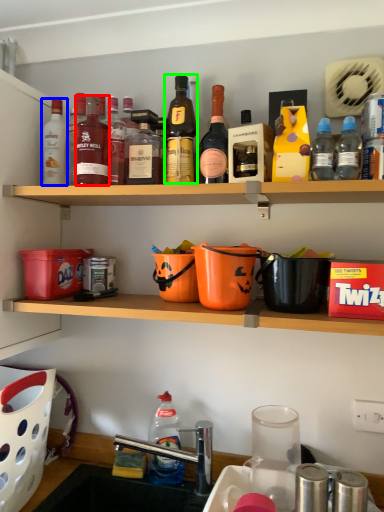
Question: Based on their relative distances, which object is nearer to bottle (highlighted by a red box)? Choose from bottle (highlighted by a blue box) and bottle (highlighted by a green box).

Choices:
 (A) bottle
 (B) bottle

Answer: (A)